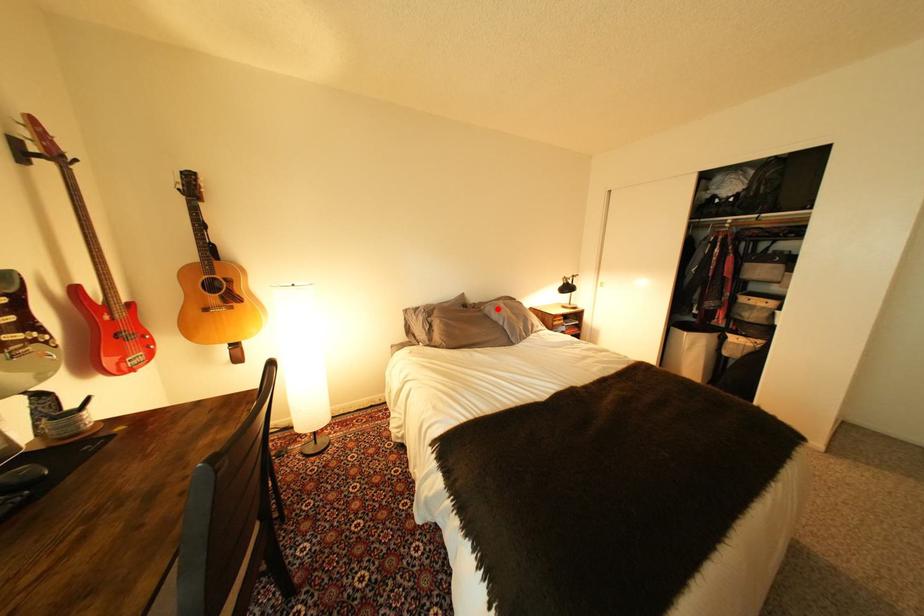
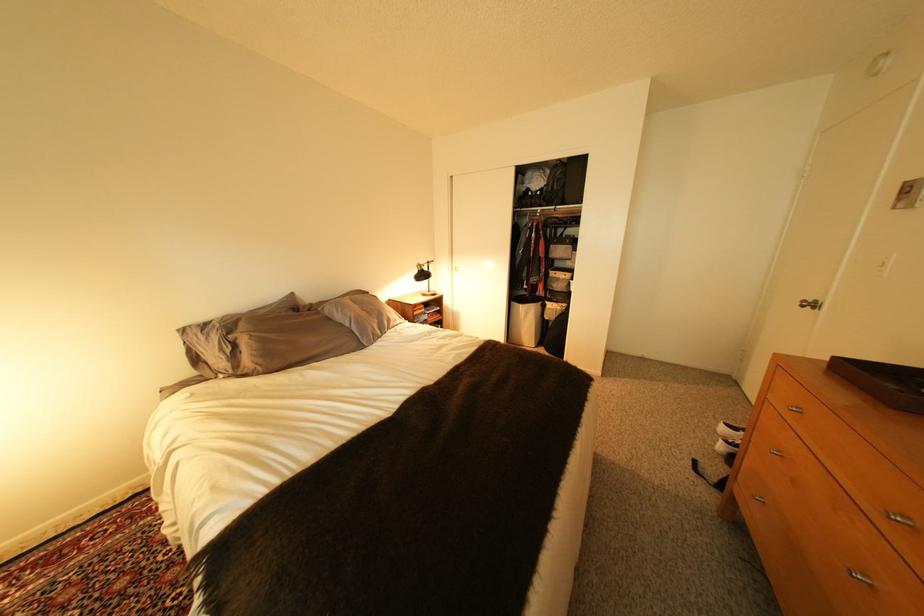
Find the pixel in the second image that matches the highlighted location in the first image.

(335, 310)